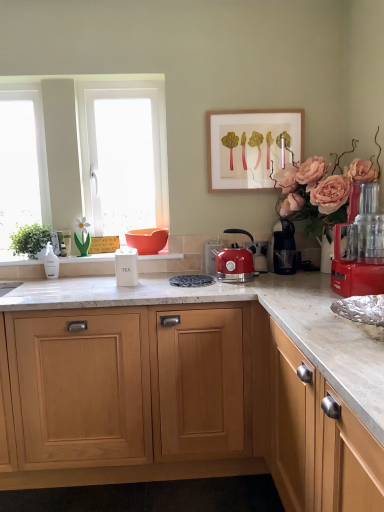
Question: Considering the relative sizes of light wood cabinet at center and matte orange bowl at center in the image provided, is light wood cabinet at center smaller than matte orange bowl at center?

Choices:
 (A) no
 (B) yes

Answer: (A)

Question: Considering the relative sizes of light wood cabinet at center and matte orange bowl at center in the image provided, is light wood cabinet at center taller than matte orange bowl at center?

Choices:
 (A) yes
 (B) no

Answer: (A)

Question: Does light wood cabinet at center have a larger size compared to matte orange bowl at center?

Choices:
 (A) yes
 (B) no

Answer: (A)

Question: Is light wood cabinet at center shorter than matte orange bowl at center?

Choices:
 (A) no
 (B) yes

Answer: (A)

Question: Is light wood cabinet at center positioned in front of matte orange bowl at center?

Choices:
 (A) yes
 (B) no

Answer: (A)

Question: Looking at their shapes, would you say white glass window at left is wider or thinner than white glossy window sill at center?

Choices:
 (A) wide
 (B) thin

Answer: (B)

Question: Is point (31, 219) positioned closer to the camera than point (107, 263)?

Choices:
 (A) closer
 (B) farther

Answer: (B)

Question: From a real-world perspective, is white glass window at left positioned above or below white glossy window sill at center?

Choices:
 (A) below
 (B) above

Answer: (B)

Question: Is white glass window at left inside or outside of white glossy window sill at center?

Choices:
 (A) inside
 (B) outside

Answer: (B)

Question: Would you say matte orange bowl at center is inside or outside wooden picture frame at upper center?

Choices:
 (A) outside
 (B) inside

Answer: (A)

Question: From the image's perspective, is matte orange bowl at center above or below wooden picture frame at upper center?

Choices:
 (A) above
 (B) below

Answer: (B)

Question: Looking at the image, does matte orange bowl at center seem bigger or smaller compared to wooden picture frame at upper center?

Choices:
 (A) small
 (B) big

Answer: (A)

Question: Considering the positions of matte orange bowl at center and wooden picture frame at upper center in the image, is matte orange bowl at center taller or shorter than wooden picture frame at upper center?

Choices:
 (A) tall
 (B) short

Answer: (B)

Question: From their relative heights in the image, would you say white matte tea container at center, which ranks as the third kitchen appliance in back-to-front order, is taller or shorter than green leafy plant at left?

Choices:
 (A) tall
 (B) short

Answer: (A)

Question: In terms of size, does white matte tea container at center, which ranks as the third kitchen appliance in back-to-front order, appear bigger or smaller than green leafy plant at left?

Choices:
 (A) small
 (B) big

Answer: (A)